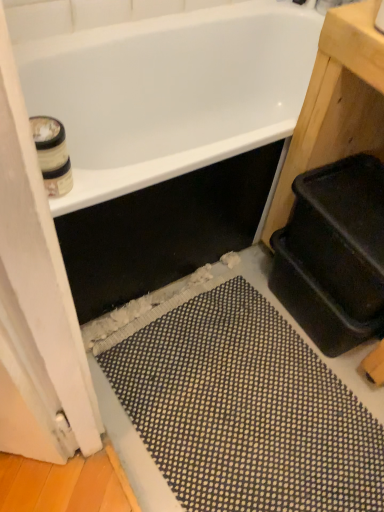
Locate an element on the screen. The image size is (384, 512). vacant area located to the right-hand side of white cardboard toilet paper at upper left is located at coordinates (112, 178).